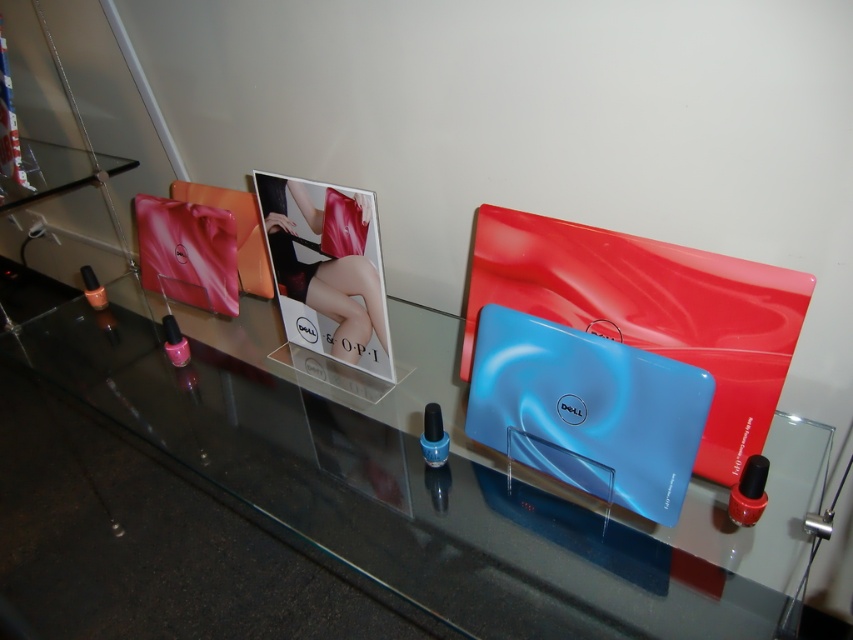
Based on the photo, which is below, shiny glass table at center or satin red dress at center?

shiny glass table at center is lower down.

Which is in front, point (329, 448) or point (341, 241)?

Point (329, 448) is more forward.

You are a GUI agent. You are given a task and a screenshot of the screen. Output one action in this format:
    pyautogui.click(x=<x>, y=<y>)
    Task: Click on the shiny glass table at center
    This screenshot has height=640, width=853.
    Given the screenshot: What is the action you would take?
    pyautogui.click(x=392, y=490)

Where is `shiny glass table at center`? The image size is (853, 640). shiny glass table at center is located at coordinates (392, 490).

Is blue glossy laptop at center above satin red dress at center?

No, blue glossy laptop at center is not above satin red dress at center.

Between blue glossy laptop at center and satin red dress at center, which one appears on the left side from the viewer's perspective?

satin red dress at center is more to the left.

Is point (625, 496) farther from camera compared to point (332, 348)?

No, it is not.

I want to click on blue glossy laptop at center, so click(587, 410).

Between shiny glass table at center and blue glossy laptop at center, which one is positioned lower?

Positioned lower is shiny glass table at center.

Is shiny glass table at center below blue glossy laptop at center?

Yes.

Between point (445, 518) and point (479, 356), which one is positioned in front?

Point (445, 518) is more forward.

Image resolution: width=853 pixels, height=640 pixels. Identify the location of shiny glass table at center. (392, 490).